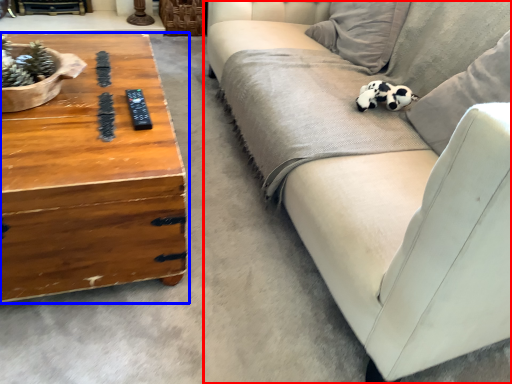
Question: Which of the following is the farthest to the observer, studio couch (highlighted by a red box) or coffee table (highlighted by a blue box)?

Choices:
 (A) studio couch
 (B) coffee table

Answer: (A)